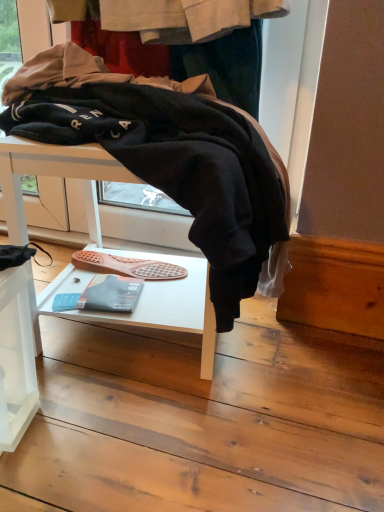
What do you see at coordinates (55, 176) in the screenshot? I see `white matte table at center` at bounding box center [55, 176].

What is the approximate width of white matte table at center?

It is 8.91 inches.

Where is `white matte table at center`? Image resolution: width=384 pixels, height=512 pixels. white matte table at center is located at coordinates (55, 176).

You are a GUI agent. You are given a task and a screenshot of the screen. Output one action in this format:
    pyautogui.click(x=<x>, y=<y>)
    Task: Click on the white matte table at center
    
    Given the screenshot: What is the action you would take?
    pyautogui.click(x=55, y=176)